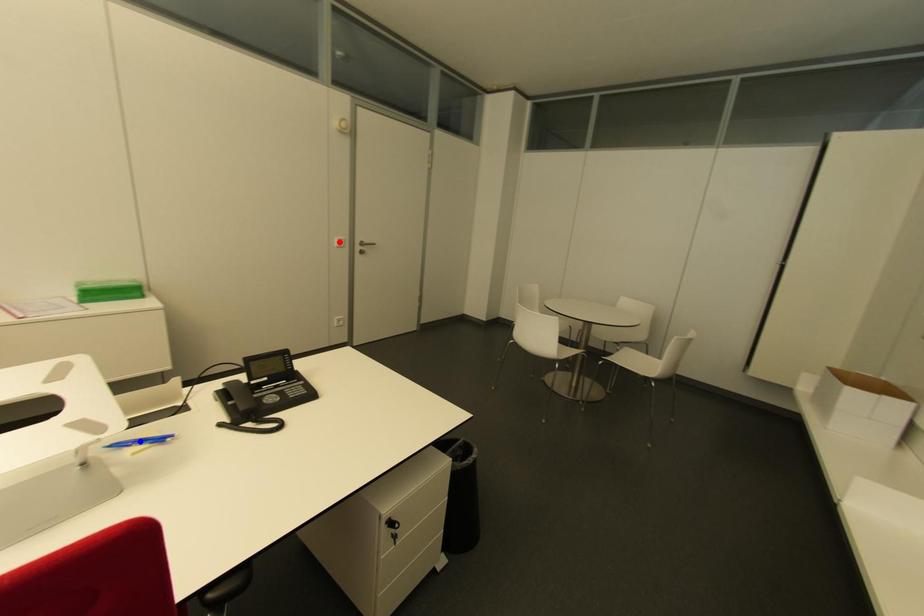
Question: In the image, two points are highlighted. Which point is nearer to the camera? Reply with the corresponding letter.

Choices:
 (A) blue point
 (B) red point

Answer: (A)